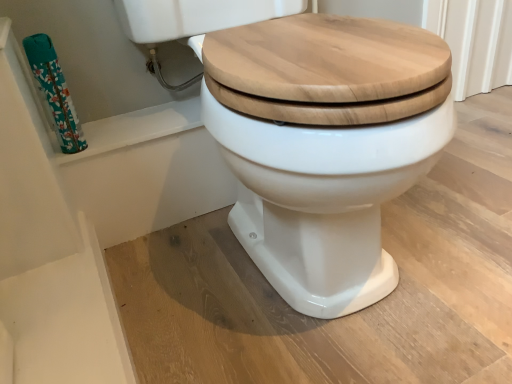
At what (x,y) coordinates should I click in order to perform the action: click on unoccupied area behind teal floral-patterned toilet paper at left. Please return your answer as a coordinate pair (x, y). Looking at the image, I should click on [x=120, y=121].